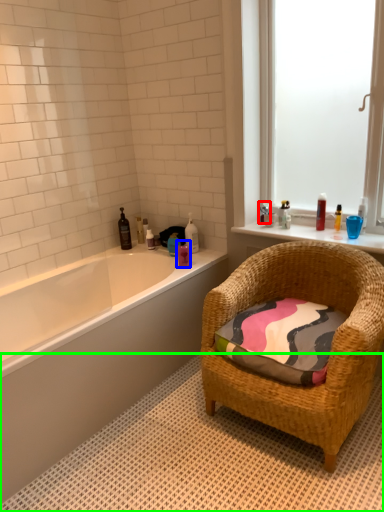
Question: Which is nearer to the toiletry (highlighted by a red box)? toiletry (highlighted by a blue box) or bath mat (highlighted by a green box).

Choices:
 (A) toiletry
 (B) bath mat

Answer: (A)